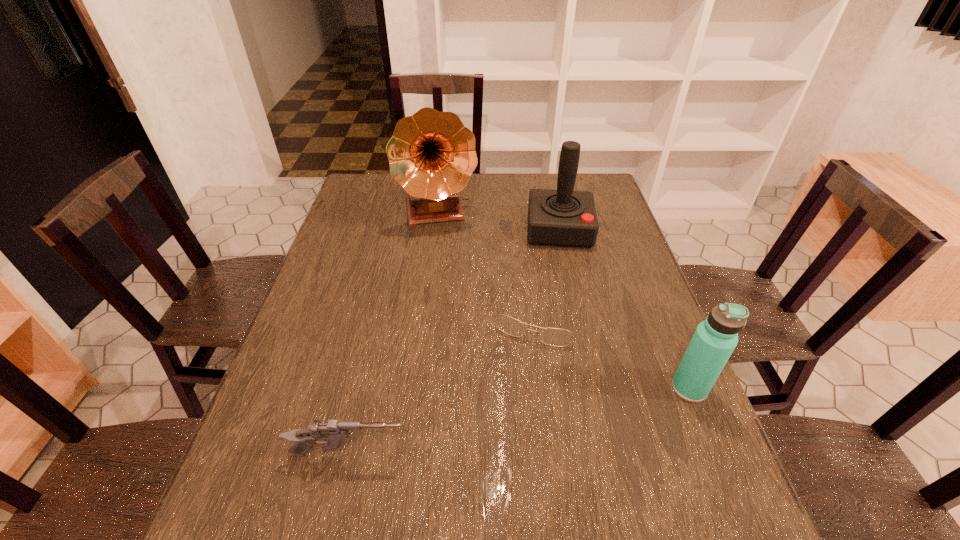
You are a GUI agent. You are given a task and a screenshot of the screen. Output one action in this format:
    pyautogui.click(x=<x>, y=<y>)
    Task: Click on the vacant space positioned on the horn of the tallest object
    
    Given the screenshot: What is the action you would take?
    pyautogui.click(x=453, y=293)

Image resolution: width=960 pixels, height=540 pixels. What are the coordinates of `blank area located 0.340m on the horn of the tallest object` in the screenshot? It's located at (457, 314).

This screenshot has height=540, width=960. In order to click on vacant region located on the horn of the tallest object in this screenshot , I will do `click(446, 249)`.

Image resolution: width=960 pixels, height=540 pixels. Identify the location of vacant position located on the front-facing side of the third nearest object. (519, 375).

The height and width of the screenshot is (540, 960). I want to click on free location located 0.180m on the front-facing side of the third nearest object, so click(x=509, y=409).

In order to click on vacant space located on the front-facing side of the third nearest object in this screenshot , I will do `click(524, 362)`.

You are a GUI agent. You are given a task and a screenshot of the screen. Output one action in this format:
    pyautogui.click(x=<x>, y=<y>)
    Task: Click on the free region located on the base of the joystick
    The width and height of the screenshot is (960, 540).
    Given the screenshot: What is the action you would take?
    pyautogui.click(x=564, y=294)

Where is `vacant area situated on the base of the joystick`? The width and height of the screenshot is (960, 540). vacant area situated on the base of the joystick is located at coordinates (562, 261).

Where is `free space located 0.110m on the base of the joystick`? This screenshot has width=960, height=540. free space located 0.110m on the base of the joystick is located at coordinates (563, 275).

Where is `object positioned at the far edge`? object positioned at the far edge is located at coordinates (432, 155).